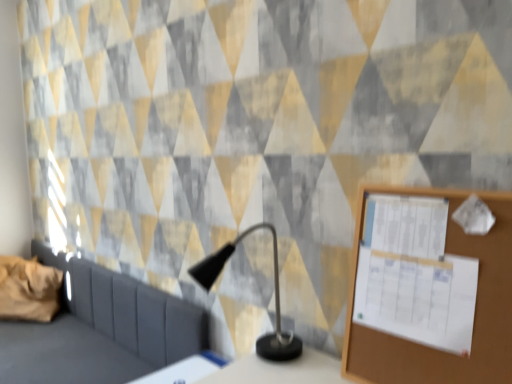
Question: Does wooden bulletin board at right come in front of white glossy table at lower center?

Choices:
 (A) no
 (B) yes

Answer: (B)

Question: Is wooden bulletin board at right aimed at white glossy table at lower center?

Choices:
 (A) yes
 (B) no

Answer: (B)

Question: Considering the relative sizes of wooden bulletin board at right and white glossy table at lower center in the image provided, is wooden bulletin board at right taller than white glossy table at lower center?

Choices:
 (A) yes
 (B) no

Answer: (A)

Question: From a real-world perspective, does wooden bulletin board at right stand above white glossy table at lower center?

Choices:
 (A) no
 (B) yes

Answer: (B)

Question: Does wooden bulletin board at right have a greater width compared to white glossy table at lower center?

Choices:
 (A) no
 (B) yes

Answer: (A)

Question: From their relative heights in the image, would you say white glossy table at lower center is taller or shorter than brown fabric pillow at left?

Choices:
 (A) short
 (B) tall

Answer: (A)

Question: Would you say white glossy table at lower center is inside or outside brown fabric pillow at left?

Choices:
 (A) outside
 (B) inside

Answer: (A)

Question: From the image's perspective, is white glossy table at lower center above or below brown fabric pillow at left?

Choices:
 (A) above
 (B) below

Answer: (B)

Question: In terms of width, does white glossy table at lower center look wider or thinner when compared to brown fabric pillow at left?

Choices:
 (A) wide
 (B) thin

Answer: (B)

Question: Considering the positions of dark gray fabric sofa at left and brown fabric pillow at left in the image, is dark gray fabric sofa at left taller or shorter than brown fabric pillow at left?

Choices:
 (A) tall
 (B) short

Answer: (A)

Question: Relative to brown fabric pillow at left, is dark gray fabric sofa at left in front or behind?

Choices:
 (A) front
 (B) behind

Answer: (A)

Question: Visually, is dark gray fabric sofa at left positioned to the left or to the right of brown fabric pillow at left?

Choices:
 (A) right
 (B) left

Answer: (A)

Question: From the image's perspective, is dark gray fabric sofa at left located above or below brown fabric pillow at left?

Choices:
 (A) below
 (B) above

Answer: (A)

Question: Based on their positions, is white glossy table at lower center located to the left or right of black matte table lamp at center?

Choices:
 (A) left
 (B) right

Answer: (A)

Question: Does point (159, 372) appear closer or farther from the camera than point (276, 339)?

Choices:
 (A) closer
 (B) farther

Answer: (A)